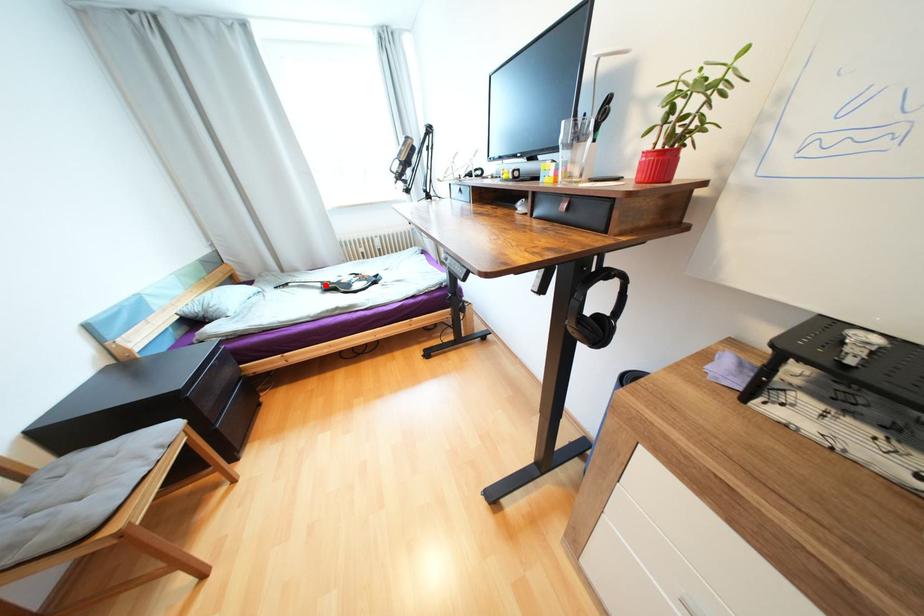
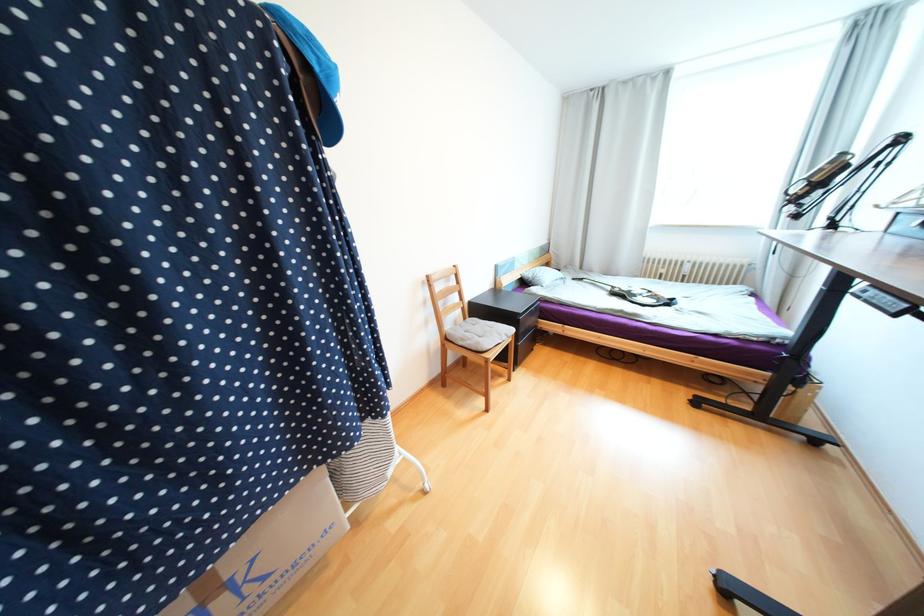
The point at the highlighted location is marked in the first image. Where is the corresponding point in the second image?

(614, 288)